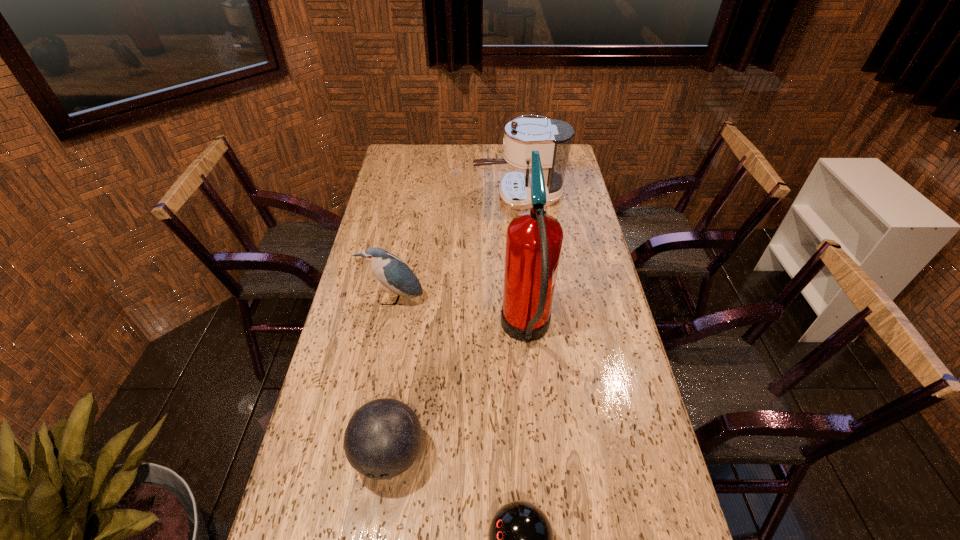
Identify the location of vacant point located between the farthest object and the third tallest object. Image resolution: width=960 pixels, height=540 pixels. (456, 248).

You are a GUI agent. You are given a task and a screenshot of the screen. Output one action in this format:
    pyautogui.click(x=<x>, y=<y>)
    Task: Click on the free point between the left bowling ball and the second tallest object
    Image resolution: width=960 pixels, height=540 pixels.
    Given the screenshot: What is the action you would take?
    pyautogui.click(x=454, y=326)

Identify the location of free spot between the taller bowling ball and the fire extinguisher. point(458,394).

I want to click on free space between the farthest object and the farther bowling ball, so click(454, 326).

In order to click on vacant point located between the farthest object and the third tallest object in this screenshot , I will do `click(456, 248)`.

Identify which object is the fourth closest to the fire extinguisher. Please provide its 2D coordinates. Your answer should be formatted as a tuple, i.e. [(x, y)], where the tuple contains the x and y coordinates of a point satisfying the conditions above.

[(552, 138)]

Identify the location of the closest object relative to the bird. (534, 239).

What are the coordinates of `vacant space that satisfies the following two spatial constraints: 1. on the front-facing side of the farthest object; 2. at the tip of the bird's beak` in the screenshot? It's located at [530, 300].

Where is `blank space that satisfies the following two spatial constraints: 1. at the tip of the third tallest object's beak; 2. on the right side of the tallest object`? The image size is (960, 540). blank space that satisfies the following two spatial constraints: 1. at the tip of the third tallest object's beak; 2. on the right side of the tallest object is located at coordinates (388, 333).

You are a GUI agent. You are given a task and a screenshot of the screen. Output one action in this format:
    pyautogui.click(x=<x>, y=<y>)
    Task: Click on the vacant area in the image that satisfies the following two spatial constraints: 1. on the front-facing side of the second tallest object; 2. on the front side of the tallest object
    The image size is (960, 540).
    Given the screenshot: What is the action you would take?
    pyautogui.click(x=534, y=333)